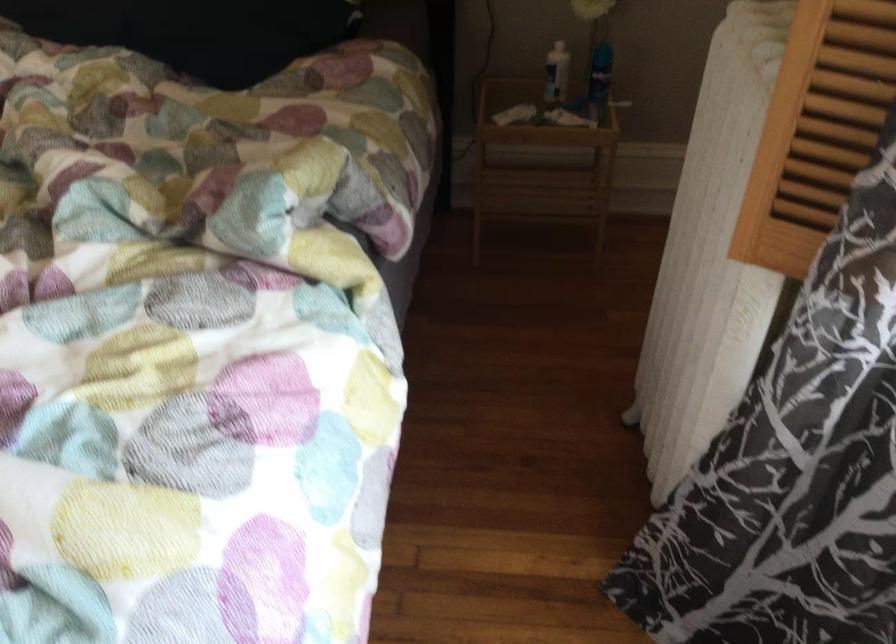
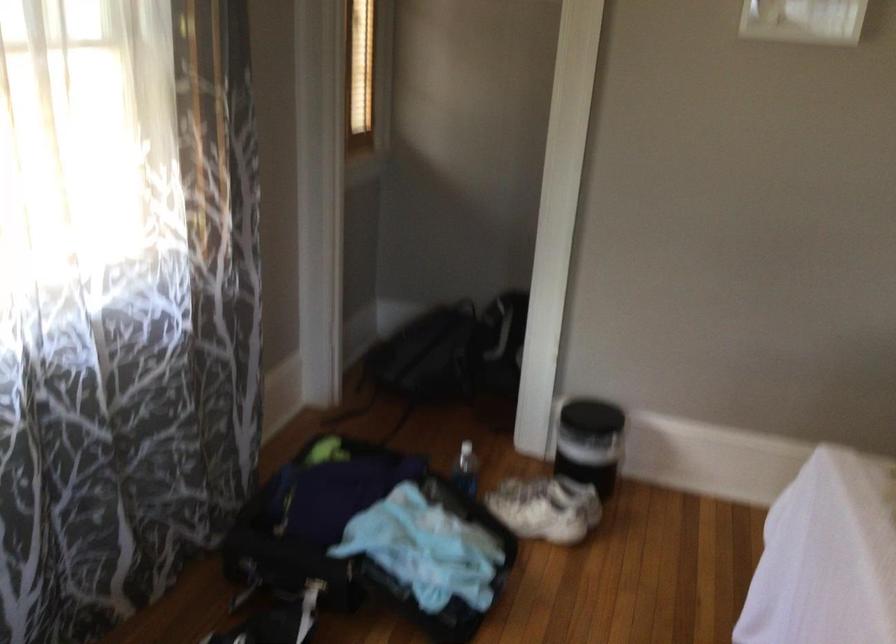
First-person continuous shooting, in which direction is the camera rotating?

The camera rotated toward left-down.